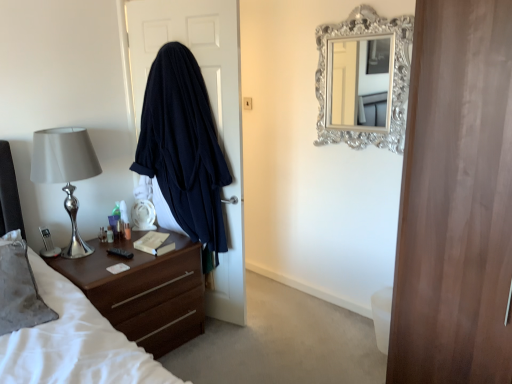
Locate an element on the screen. This screenshot has height=384, width=512. empty space that is ontop of silver ornate mirror at upper center (from a real-world perspective) is located at coordinates (340, 6).